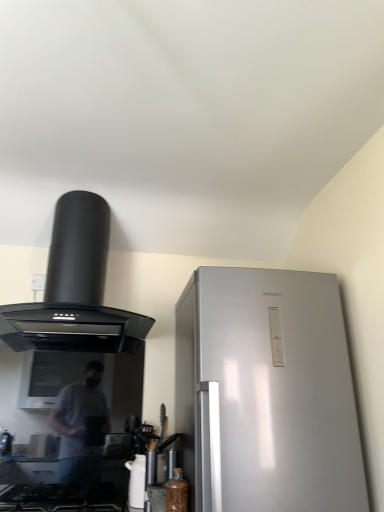
The height and width of the screenshot is (512, 384). What do you see at coordinates (136, 481) in the screenshot? I see `white glossy kettle at lower center` at bounding box center [136, 481].

I want to click on black matte range hood at upper left, so click(x=75, y=289).

Describe the element at coordinates (75, 289) in the screenshot. This screenshot has width=384, height=512. I see `black matte range hood at upper left` at that location.

The width and height of the screenshot is (384, 512). What do you see at coordinates (60, 498) in the screenshot?
I see `black glass gas stove at lower left` at bounding box center [60, 498].

The width and height of the screenshot is (384, 512). Identify the location of translucent glass bottle at lower center. (177, 492).

Can you confirm if white glossy kettle at lower center is positioned to the left of black matte range hood at upper left?

Incorrect, white glossy kettle at lower center is not on the left side of black matte range hood at upper left.

At what (x,y) coordinates should I click in order to perform the action: click on appliance located underneath the black matte range hood at upper left (from a real-world perspective). Please return your answer as a coordinate pair (x, y). The width and height of the screenshot is (384, 512). Looking at the image, I should click on (136, 481).

From a real-world perspective, is white glossy kettle at lower center above or below black matte range hood at upper left?

white glossy kettle at lower center is below black matte range hood at upper left.

Looking at the image, does white glossy kettle at lower center seem bigger or smaller compared to black matte range hood at upper left?

Clearly, white glossy kettle at lower center is smaller in size than black matte range hood at upper left.

Would you say black glass gas stove at lower left is a long distance from black matte range hood at upper left?

No, there isn't a large distance between black glass gas stove at lower left and black matte range hood at upper left.

Is black glass gas stove at lower left facing away from black matte range hood at upper left?

No, black matte range hood at upper left is not at the back of black glass gas stove at lower left.

Considering the relative sizes of black matte range hood at upper left and black glass gas stove at lower left in the image provided, is black matte range hood at upper left smaller than black glass gas stove at lower left?

No.

Does point (94, 349) come closer to viewer compared to point (112, 486)?

No, (94, 349) is further to viewer.

From the image's perspective, would you say black matte range hood at upper left is positioned over black glass gas stove at lower left?

Indeed, from the image's perspective, black matte range hood at upper left is shown above black glass gas stove at lower left.

I want to click on gas stove on the left of translucent glass bottle at lower center, so click(x=60, y=498).

Is point (182, 490) in front of point (61, 497)?

Yes.

Is translucent glass bottle at lower center not within black glass gas stove at lower left?

Indeed, translucent glass bottle at lower center is completely outside black glass gas stove at lower left.

From a real-world perspective, between translucent glass bottle at lower center and black glass gas stove at lower left, who is vertically lower?

From a 3D spatial view, black glass gas stove at lower left is below.

Is white glossy kettle at lower center beside translucent glass bottle at lower center?

No, white glossy kettle at lower center is not touching translucent glass bottle at lower center.

Which is closer to the camera, (x=141, y=460) or (x=182, y=484)?

The point (x=182, y=484) is closer.

From the picture: Considering the relative sizes of white glossy kettle at lower center and translucent glass bottle at lower center in the image provided, is white glossy kettle at lower center bigger than translucent glass bottle at lower center?

Correct, white glossy kettle at lower center is larger in size than translucent glass bottle at lower center.

Does translucent glass bottle at lower center have a smaller size compared to black matte range hood at upper left?

Yes, translucent glass bottle at lower center is smaller than black matte range hood at upper left.

Is translucent glass bottle at lower center positioned with its back to black matte range hood at upper left?

No.

How many degrees apart are the facing directions of translucent glass bottle at lower center and black matte range hood at upper left?

3.89 degrees.

Does translucent glass bottle at lower center contain black matte range hood at upper left?

Definitely not — black matte range hood at upper left is not inside translucent glass bottle at lower center.

Between black glass gas stove at lower left and white glossy kettle at lower center, which one has larger width?

Wider between the two is black glass gas stove at lower left.

Which point is more forward, (3, 497) or (139, 489)?

The point (3, 497) is more forward.

Can you confirm if black glass gas stove at lower left is smaller than white glossy kettle at lower center?

Actually, black glass gas stove at lower left might be larger than white glossy kettle at lower center.

Is black glass gas stove at lower left positioned before white glossy kettle at lower center?

That is True.

Where is `appliance that is below the black matte range hood at upper left (from the image's perspective)`? The width and height of the screenshot is (384, 512). appliance that is below the black matte range hood at upper left (from the image's perspective) is located at coordinates (136, 481).

Find the location of `gas stove below the black matte range hood at upper left (from a real-world perspective)`. gas stove below the black matte range hood at upper left (from a real-world perspective) is located at coordinates (60, 498).

Which object lies further to the anchor point translucent glass bottle at lower center, black matte range hood at upper left or white glossy kettle at lower center?

black matte range hood at upper left is positioned further to the anchor translucent glass bottle at lower center.

Considering their positions, is black glass gas stove at lower left positioned closer to black matte range hood at upper left than white glossy kettle at lower center?

white glossy kettle at lower center is closer to black matte range hood at upper left.

Looking at the image, which one is located further to black glass gas stove at lower left, translucent glass bottle at lower center or white glossy kettle at lower center?

Based on the image, translucent glass bottle at lower center appears to be further to black glass gas stove at lower left.

From the image, which object appears to be farther from translucent glass bottle at lower center, white glossy kettle at lower center or black matte range hood at upper left?

black matte range hood at upper left is further to translucent glass bottle at lower center.

Looking at the image, which one is located closer to translucent glass bottle at lower center, white glossy kettle at lower center or black glass gas stove at lower left?

white glossy kettle at lower center is positioned closer to the anchor translucent glass bottle at lower center.

Based on their spatial positions, is black matte range hood at upper left or black glass gas stove at lower left further from translucent glass bottle at lower center?

black matte range hood at upper left is positioned further to the anchor translucent glass bottle at lower center.

Which object lies nearer to the anchor point black glass gas stove at lower left, white glossy kettle at lower center or black matte range hood at upper left?

white glossy kettle at lower center.

Which object lies further to the anchor point translucent glass bottle at lower center, black glass gas stove at lower left or black matte range hood at upper left?

black matte range hood at upper left is positioned further to the anchor translucent glass bottle at lower center.

Locate an element on the screen. appliance between black matte range hood at upper left and black glass gas stove at lower left from top to bottom is located at coordinates tap(136, 481).

Locate an element on the screen. appliance located between black glass gas stove at lower left and translucent glass bottle at lower center in the left-right direction is located at coordinates (136, 481).

Find the location of a particular element. bottle between black matte range hood at upper left and white glossy kettle at lower center vertically is located at coordinates (177, 492).

The height and width of the screenshot is (512, 384). I want to click on bottle between black matte range hood at upper left and black glass gas stove at lower left vertically, so click(x=177, y=492).